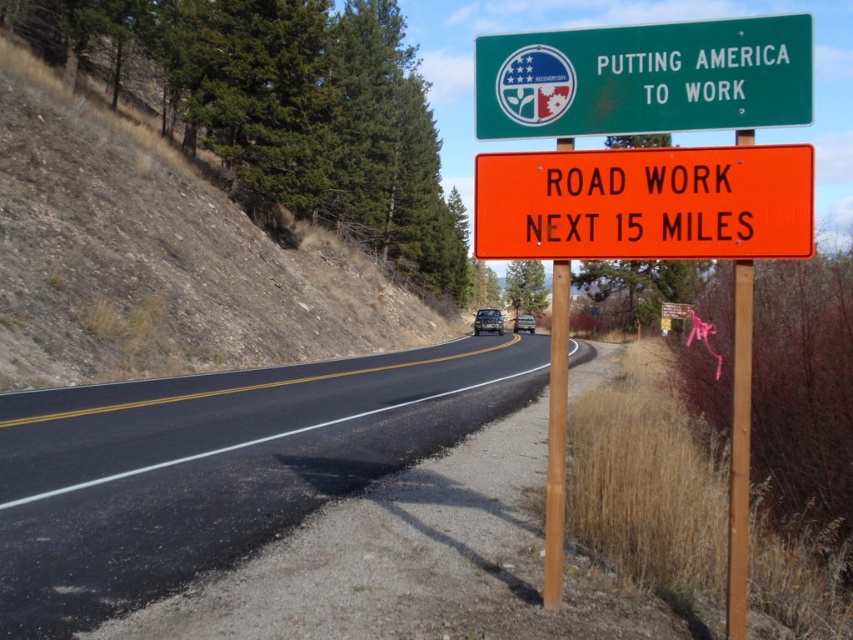
In the scene shown: You are driving on the black asphalt road at center and see the orange reflective plastic sign at right. Which object is positioned higher in the image?

The orange reflective plastic sign at right is positioned higher than the black asphalt road at center.

In the scene shown: You are driving on a highway and see two points marked on the road ahead. The first point is at coordinates point (x=367, y=388) and the second is at point (x=775, y=145). Which point is closer to your current position?

Point (x=367, y=388) is closer to your current position because it is further to the viewer than point (x=775, y=145), meaning it is nearer to you.

You are a truck driver approaching the two road signs on the highway. The orange reflective plastic sign at right and the green metallic sign at upper center are both visible. Which sign has a wider width?

The green metallic sign at upper center has a wider width compared to the orange reflective plastic sign at right, as the orange reflective plastic sign at right has a lesser width.